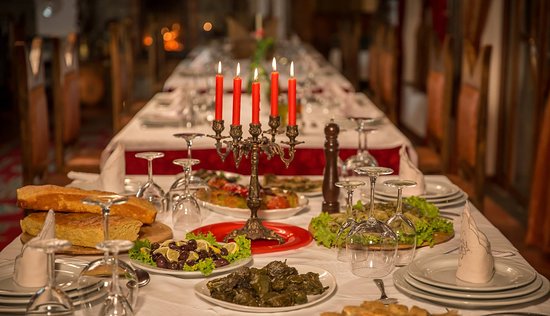
Locate an element on the screen. Image resolution: width=550 pixels, height=316 pixels. candle holder is located at coordinates (252, 187).